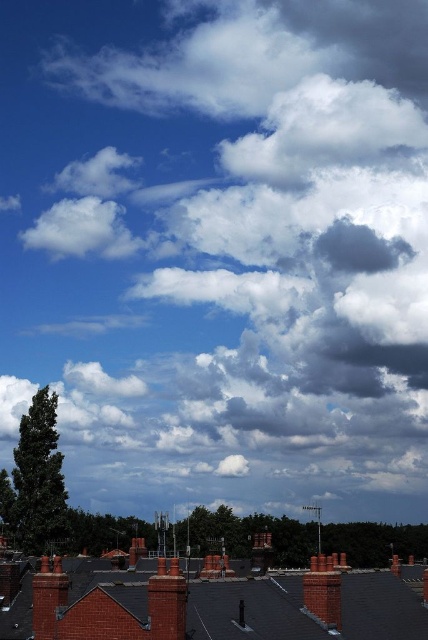
You are standing on a balcony overlooking the rooftops. You notice two red brick chimneys. Which one is closer to you, the red brick chimney at center or the red brick chimney at lower left?

The red brick chimney at center is closer to you because it is in front of the red brick chimney at lower left.

You are standing in a city square and see two points in the sky, one at point (175, 577) and the other at point (312, 602). Which point is closer to you?

Point (175, 577) is closer to the camera than point (312, 602), so the point at (175, 577) is closer to you.